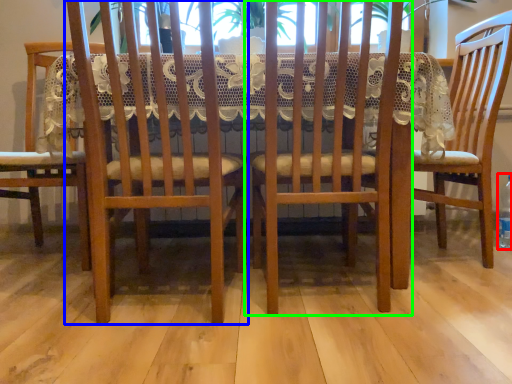
Question: Which is farther away from bottle (highlighted by a red box)? chair (highlighted by a blue box) or chair (highlighted by a green box)?

Choices:
 (A) chair
 (B) chair

Answer: (A)